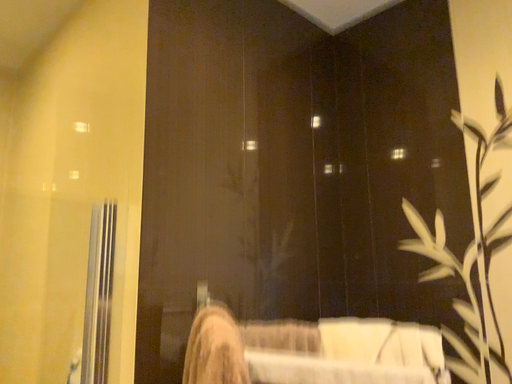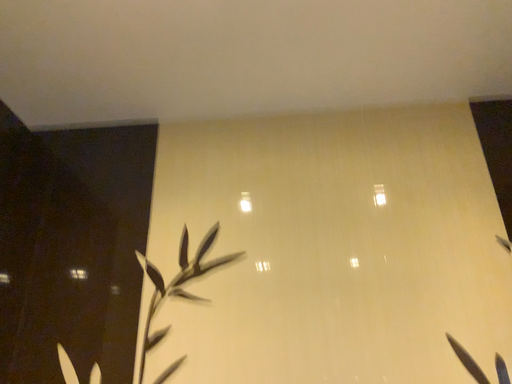
Question: How did the camera likely rotate when shooting the video?

Choices:
 (A) rotated left
 (B) rotated right

Answer: (B)